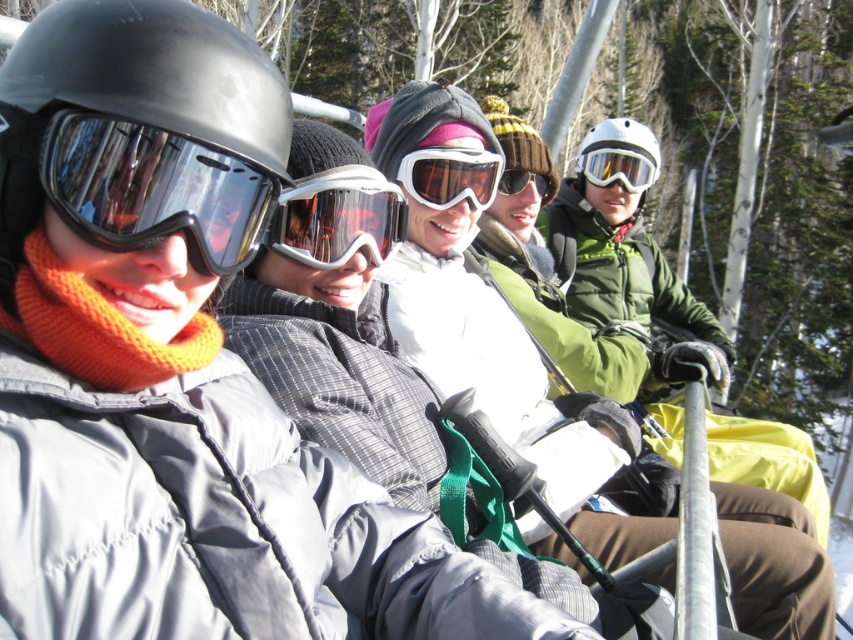
Question: Which object is farther from the camera taking this photo?

Choices:
 (A) transparent plastic goggles at center
 (B) white matte goggles at center

Answer: (A)

Question: Which point is farther from the camera taking this photo?

Choices:
 (A) (245, 124)
 (B) (364, 246)

Answer: (B)

Question: Which object appears closest to the camera in this image?

Choices:
 (A) transparent white goggles at center
 (B) white matte helmet at center
 (C) matte black helmet at left

Answer: (C)

Question: Can you confirm if matte black helmet at left is bigger than transparent white goggles at center?

Choices:
 (A) no
 (B) yes

Answer: (B)

Question: Is the position of transparent white goggles at center less distant than that of matte black goggles at center?

Choices:
 (A) yes
 (B) no

Answer: (A)

Question: Is matte black goggles at left further to camera compared to transparent plastic goggles at center?

Choices:
 (A) yes
 (B) no

Answer: (B)